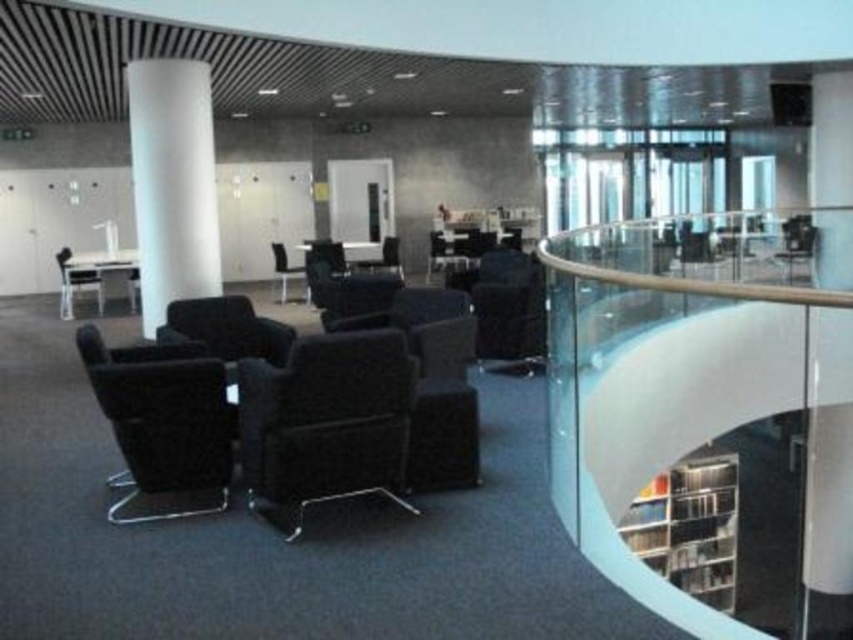
You are planning to place a tall potted plant that requires 1.8 meters of vertical space. Based on the scene, which object between the black matte bookshelf at lower right and the black leather chair at center would be the better reference to ensure the plant has enough height clearance?

The black matte bookshelf at lower right is taller than the black leather chair at center. Since the plant needs 1.8 meters of vertical space, you should check the height of the black matte bookshelf at lower right to ensure there is sufficient clearance.